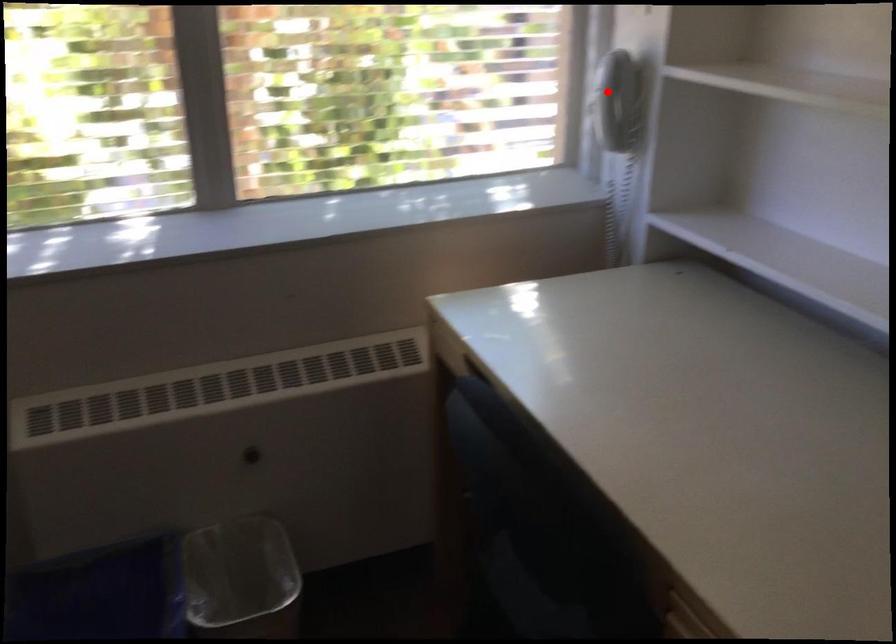
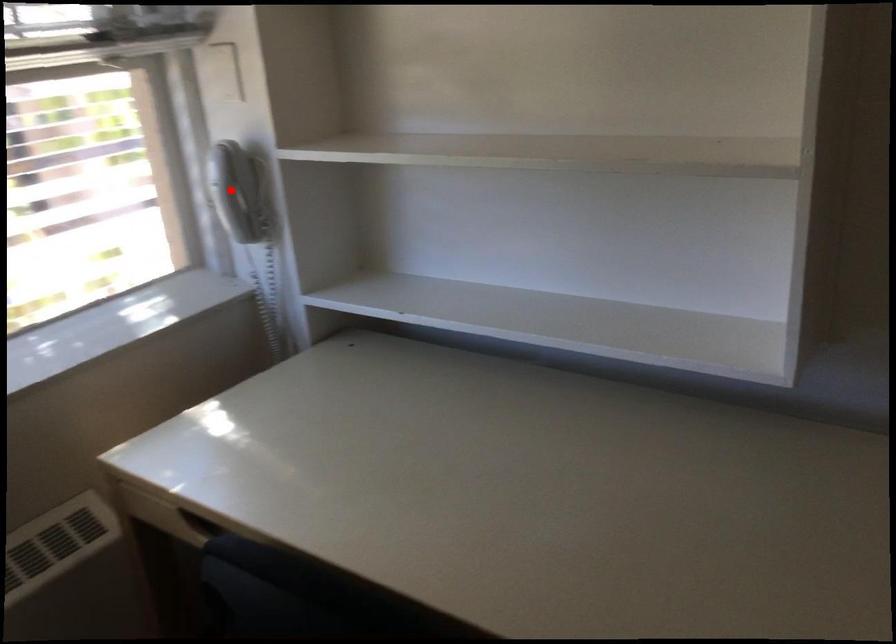
I am providing you with two images of the same scene from different viewpoints. A red point is marked on the first image and another point is marked on the second image. Do the highlighted points in image1 and image2 indicate the same real-world spot?

Yes